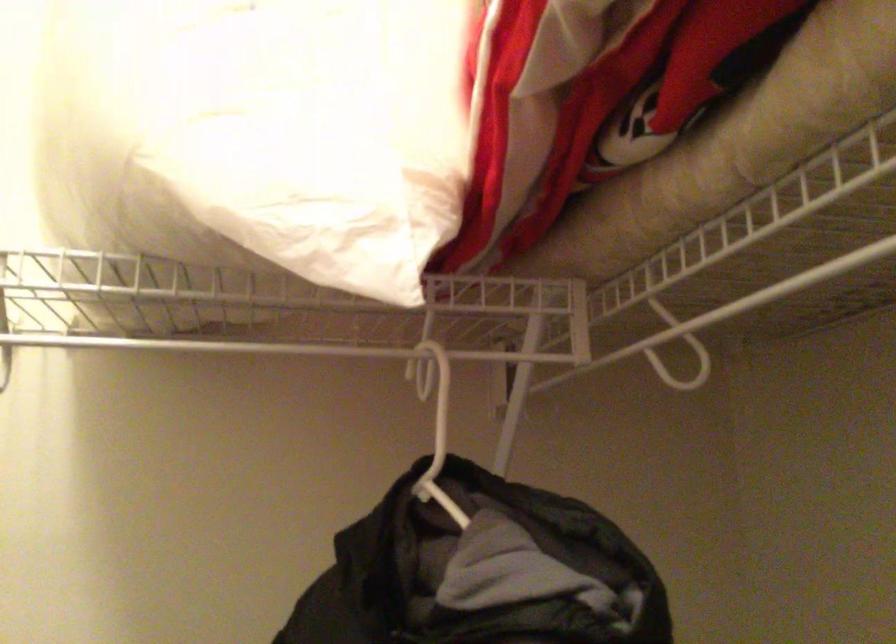
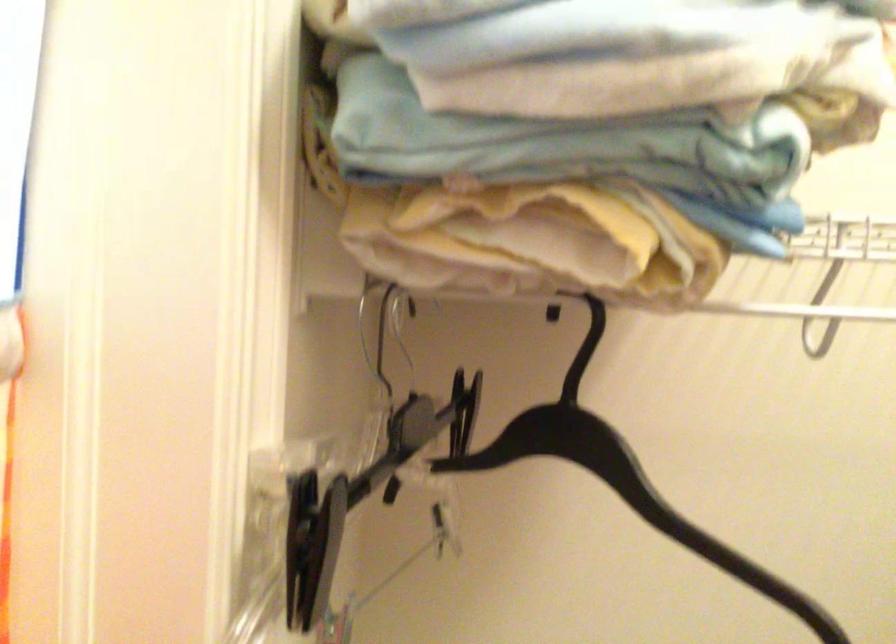
Question: What movement of the cameraman would produce the second image?

Choices:
 (A) Left
 (B) Right
 (C) Forward
 (D) Backward

Answer: (A)